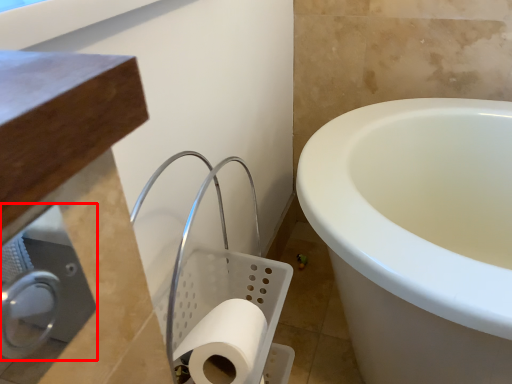
Question: Observing the image, what is the correct spatial positioning of dispenser (annotated by the red box) in reference to toilet paper?

Choices:
 (A) left
 (B) right

Answer: (A)